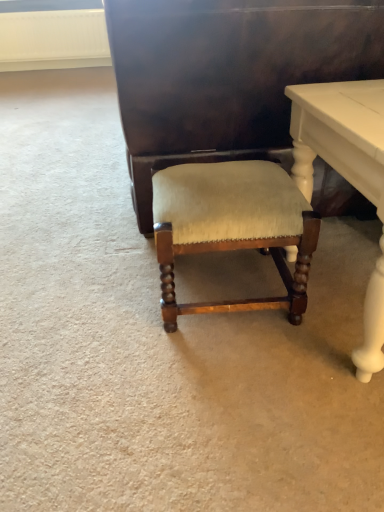
Where is `vacant space that is to the left of white glossy table at lower right`? vacant space that is to the left of white glossy table at lower right is located at coordinates (201, 360).